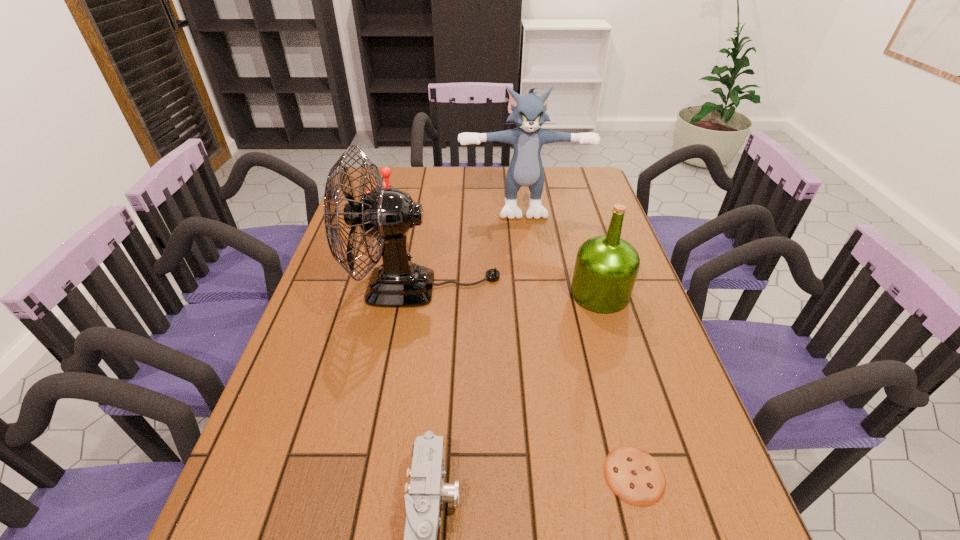
The width and height of the screenshot is (960, 540). Find the location of `vacant space that satisfies the following two spatial constraints: 1. on the back side of the third tallest object; 2. on the left side of the shortest object`. vacant space that satisfies the following two spatial constraints: 1. on the back side of the third tallest object; 2. on the left side of the shortest object is located at coordinates (587, 294).